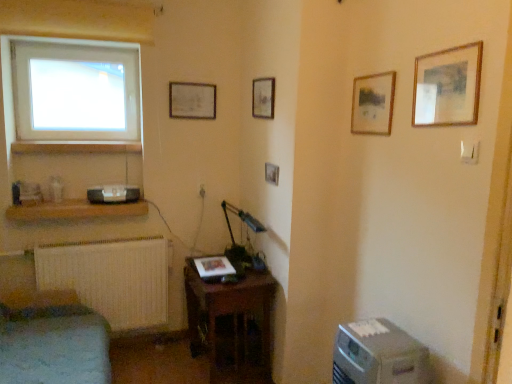
Question: Can you confirm if matte wooden picture frame at upper center, which ranks as the 5th picture frame in right-to-left order, is taller than white matte radiator at lower left?

Choices:
 (A) no
 (B) yes

Answer: (A)

Question: Is matte wooden picture frame at upper center, which ranks as the fifth picture frame in front-to-back order, bigger than white matte radiator at lower left?

Choices:
 (A) no
 (B) yes

Answer: (A)

Question: Is matte wooden picture frame at upper center, the first picture frame viewed from the back, positioned in front of white matte radiator at lower left?

Choices:
 (A) no
 (B) yes

Answer: (A)

Question: Would you consider matte wooden picture frame at upper center, arranged as the 1th picture frame when viewed from the left, to be distant from white matte radiator at lower left?

Choices:
 (A) yes
 (B) no

Answer: (A)

Question: Considering the relative positions of matte wooden picture frame at upper center, which ranks as the fifth picture frame in front-to-back order, and white matte radiator at lower left in the image provided, is matte wooden picture frame at upper center, which ranks as the fifth picture frame in front-to-back order, to the left of white matte radiator at lower left from the viewer's perspective?

Choices:
 (A) yes
 (B) no

Answer: (B)

Question: Considering the positions of wooden picture frame at upper right, the 5th picture frame from the back, and transparent glass window at upper left in the image, is wooden picture frame at upper right, the 5th picture frame from the back, taller or shorter than transparent glass window at upper left?

Choices:
 (A) short
 (B) tall

Answer: (A)

Question: From the image's perspective, is wooden picture frame at upper right, the 1th picture frame from the front, located above or below transparent glass window at upper left?

Choices:
 (A) below
 (B) above

Answer: (A)

Question: Does point (474, 57) appear closer or farther from the camera than point (32, 82)?

Choices:
 (A) farther
 (B) closer

Answer: (B)

Question: Is wooden picture frame at upper right, the first picture frame viewed from the right, to the left or to the right of transparent glass window at upper left in the image?

Choices:
 (A) left
 (B) right

Answer: (B)

Question: Is wooden table at lower center in front of or behind wooden picture frame at center, the 3th picture frame viewed from the left, in the image?

Choices:
 (A) front
 (B) behind

Answer: (A)

Question: Looking at their shapes, would you say wooden table at lower center is wider or thinner than wooden picture frame at center, the 3th picture frame viewed from the left?

Choices:
 (A) thin
 (B) wide

Answer: (B)

Question: Based on their sizes in the image, would you say wooden table at lower center is bigger or smaller than wooden picture frame at center, the third picture frame when ordered from back to front?

Choices:
 (A) big
 (B) small

Answer: (A)

Question: Is wooden table at lower center taller or shorter than wooden picture frame at center, which is the third picture frame from front to back?

Choices:
 (A) tall
 (B) short

Answer: (A)

Question: Is wooden shelf at lower left, positioned as the first shelf in bottom-to-top order, bigger or smaller than matte black speaker at lower left?

Choices:
 (A) small
 (B) big

Answer: (B)

Question: Choose the correct answer: Is wooden shelf at lower left, the 2th shelf in the top-to-bottom sequence, inside matte black speaker at lower left or outside it?

Choices:
 (A) inside
 (B) outside

Answer: (B)